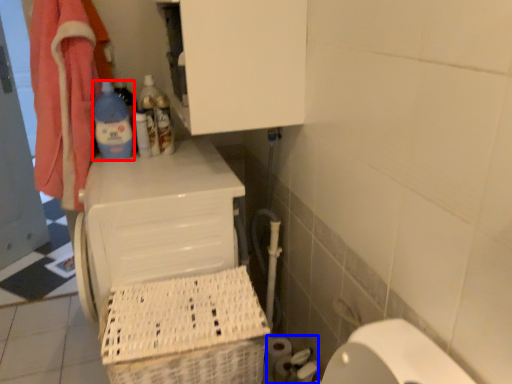
Question: Which of the following is the closest to the observer, bottle (highlighted by a red box) or toilet paper (highlighted by a blue box)?

Choices:
 (A) bottle
 (B) toilet paper

Answer: (B)